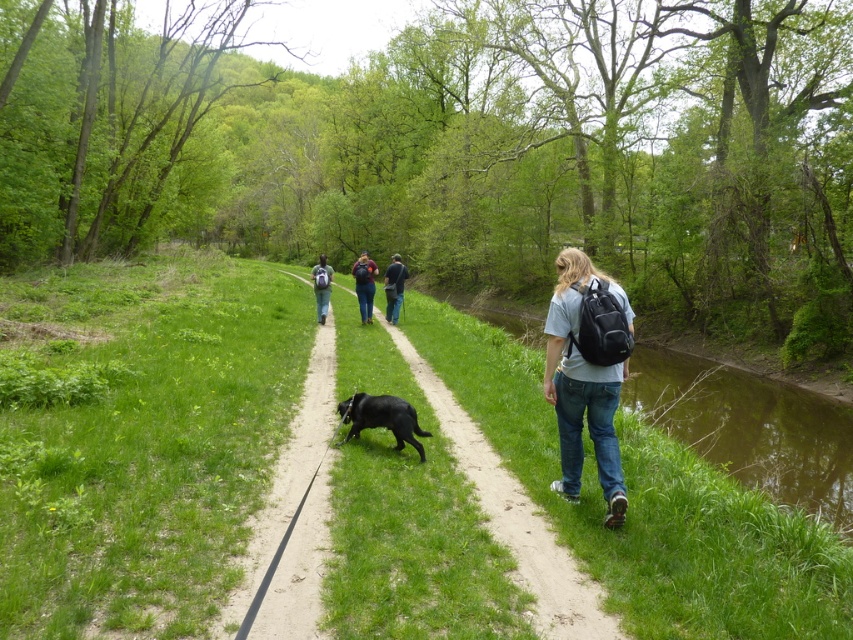
You are a hiker who wants to ensure your backpack stays secure while walking on the narrow dirt path. Based on the scene, can you tell if the matte black backpack at center is resting on top of the dark blue jeans at center?

The dark blue jeans at center is positioned under the matte black backpack at center, so yes, the matte black backpack at center is resting on top of the dark blue jeans at center.